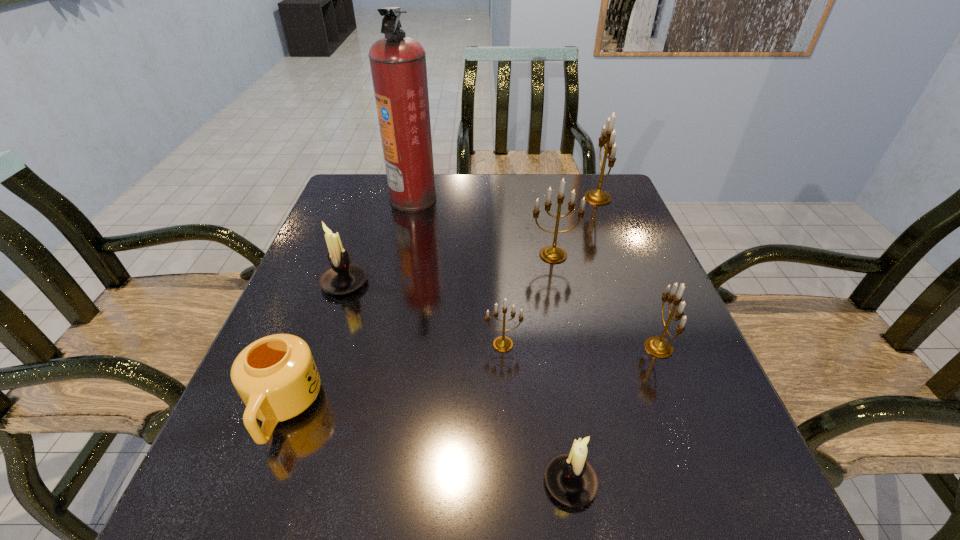
Find the location of a particular element. The image size is (960, 540). the second closest gold candelabrum relative to the third biggest gold candelabrum is located at coordinates click(x=502, y=343).

Locate which gold candelabrum is the fourth closest to the bigger white candle holder. Please provide its 2D coordinates. Your answer should be formatted as a tuple, i.e. [(x, y)], where the tuple contains the x and y coordinates of a point satisfying the conditions above.

[(597, 197)]

Locate an element on the screen. The width and height of the screenshot is (960, 540). free point that satisfies the following two spatial constraints: 1. at the nozzle of the red fire extinguisher; 2. on the handle side of the mug is located at coordinates (x=368, y=408).

Locate an element on the screen. The height and width of the screenshot is (540, 960). vacant region that satisfies the following two spatial constraints: 1. at the nozzle of the right white candle holder; 2. on the right side of the tallest object is located at coordinates (351, 483).